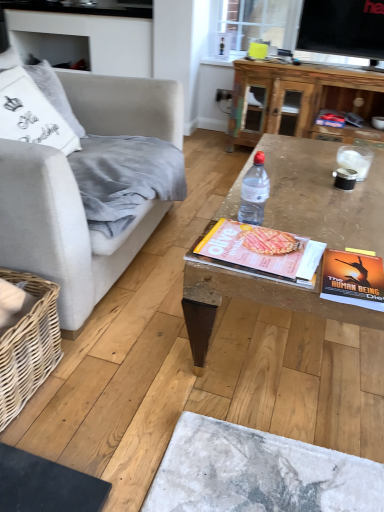
Find the location of a particular element. The image size is (384, 512). free space behind clear plastic bottle at center is located at coordinates (275, 203).